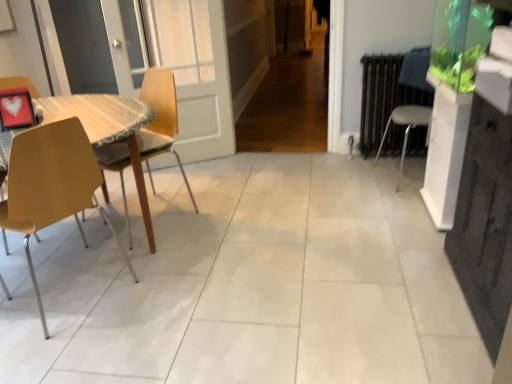
Question: Should I look upward or downward to see white plastic chair at right, arranged as the 3th chair when viewed from the left?

Choices:
 (A) down
 (B) up

Answer: (B)

Question: From the image's perspective, does white plastic chair at right, arranged as the 3th chair when viewed from the left, appear higher than matte yellow chair at left, placed as the 1th chair when sorted from left to right?

Choices:
 (A) no
 (B) yes

Answer: (B)

Question: Is white plastic chair at right, arranged as the 3th chair when viewed from the left, aimed at matte yellow chair at left, placed as the 1th chair when sorted from left to right?

Choices:
 (A) yes
 (B) no

Answer: (B)

Question: Does white plastic chair at right, arranged as the 1th chair when viewed from the right, have a larger size compared to matte yellow chair at left, placed as the 1th chair when sorted from left to right?

Choices:
 (A) yes
 (B) no

Answer: (A)

Question: Would you say matte yellow chair at left, the 3th chair viewed from the right, is part of white plastic chair at right, arranged as the 1th chair when viewed from the right,'s contents?

Choices:
 (A) yes
 (B) no

Answer: (B)

Question: Can you confirm if white plastic chair at right, arranged as the 3th chair when viewed from the left, is taller than matte yellow chair at left, the 3th chair viewed from the right?

Choices:
 (A) yes
 (B) no

Answer: (B)

Question: Considering the relative sizes of white plastic chair at right, arranged as the 1th chair when viewed from the right, and matte yellow chair at left, placed as the 1th chair when sorted from left to right, in the image provided, is white plastic chair at right, arranged as the 1th chair when viewed from the right, thinner than matte yellow chair at left, placed as the 1th chair when sorted from left to right,?

Choices:
 (A) no
 (B) yes

Answer: (A)

Question: From the image's perspective, is wooden at left, the 2th chair in the left-to-right sequence, on top of matte yellow chair at left, placed as the 1th chair when sorted from left to right?

Choices:
 (A) no
 (B) yes

Answer: (B)

Question: Does wooden at left, the 2th chair in the left-to-right sequence, lie behind matte yellow chair at left, the 3th chair viewed from the right?

Choices:
 (A) no
 (B) yes

Answer: (B)

Question: Considering the relative sizes of wooden at left, the 2th chair in the left-to-right sequence, and matte yellow chair at left, placed as the 1th chair when sorted from left to right, in the image provided, is wooden at left, the 2th chair in the left-to-right sequence, bigger than matte yellow chair at left, placed as the 1th chair when sorted from left to right,?

Choices:
 (A) no
 (B) yes

Answer: (B)

Question: Does wooden at left, arranged as the second chair when viewed from the right, turn towards matte yellow chair at left, placed as the 1th chair when sorted from left to right?

Choices:
 (A) no
 (B) yes

Answer: (B)

Question: Is wooden at left, arranged as the second chair when viewed from the right, not within matte yellow chair at left, the 3th chair viewed from the right?

Choices:
 (A) yes
 (B) no

Answer: (A)

Question: From a real-world perspective, is wooden at left, arranged as the second chair when viewed from the right, over matte yellow chair at left, placed as the 1th chair when sorted from left to right?

Choices:
 (A) yes
 (B) no

Answer: (B)

Question: From a real-world perspective, is white plastic chair at right, arranged as the 1th chair when viewed from the right, on top of wooden at left, arranged as the second chair when viewed from the right?

Choices:
 (A) no
 (B) yes

Answer: (A)